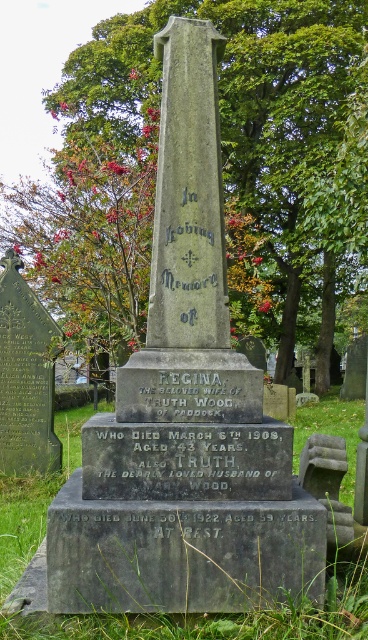
Is green leafy tree at center taller than green grass at center?

Correct, green leafy tree at center is much taller as green grass at center.

Is green leafy tree at center to the right of green grass at center from the viewer's perspective?

In fact, green leafy tree at center is to the left of green grass at center.

Between point (83, 225) and point (288, 632), which one is positioned behind?

The point (83, 225) is behind.

The image size is (368, 640). Identify the location of green leafy tree at center. (223, 168).